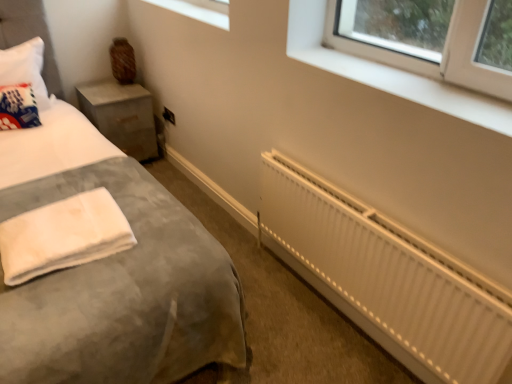
You are a GUI agent. You are given a task and a screenshot of the screen. Output one action in this format:
    pyautogui.click(x=<x>, y=<y>)
    Task: Click on the blank space situated above white plastic window at upper right, the second window positioned from the back (from a real-world perspective)
    Image resolution: width=512 pixels, height=384 pixels.
    Given the screenshot: What is the action you would take?
    pyautogui.click(x=412, y=79)